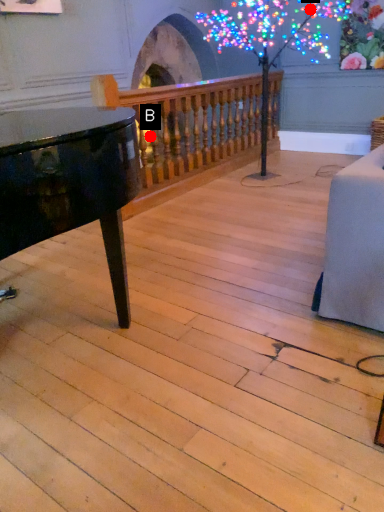
Question: Two points are circled on the image, labeled by A and B beside each circle. Which point is farther from the camera taking this photo?

Choices:
 (A) A is further
 (B) B is further

Answer: (A)